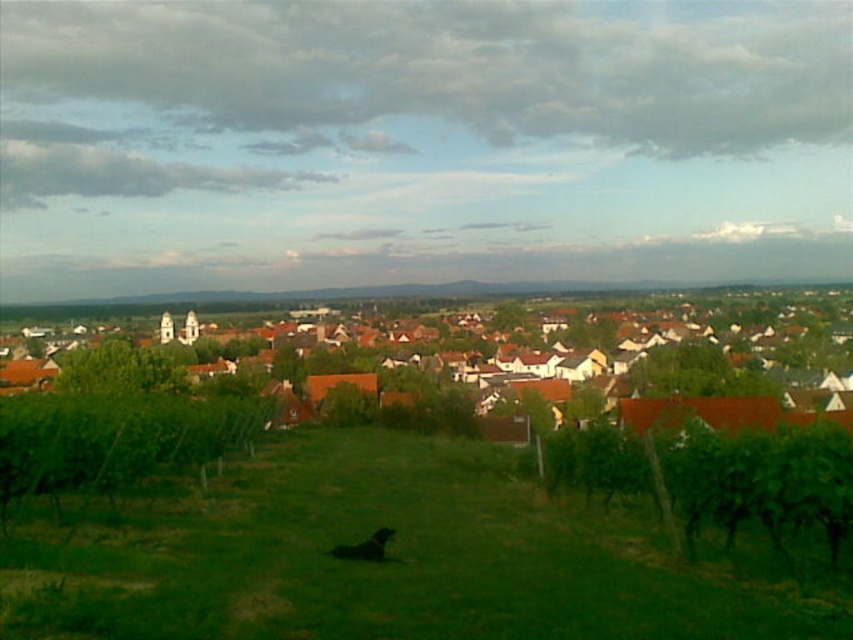
Question: Can you confirm if green grassy field at center is bigger than brown tiled roofs at center?

Choices:
 (A) yes
 (B) no

Answer: (B)

Question: Is green grassy field at center bigger than brown tiled roofs at center?

Choices:
 (A) yes
 (B) no

Answer: (B)

Question: From the image, what is the correct spatial relationship of green grassy field at center in relation to brown tiled roofs at center?

Choices:
 (A) below
 (B) above

Answer: (A)

Question: Among these objects, which one is nearest to the camera?

Choices:
 (A) brown tiled roofs at center
 (B) green grassy field at center

Answer: (B)

Question: Among these objects, which one is farthest from the camera?

Choices:
 (A) brown tiled roofs at center
 (B) green grassy field at center

Answer: (A)